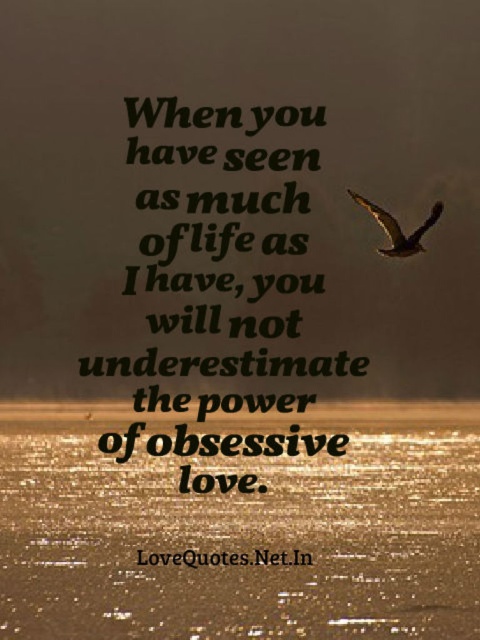
You are an artist trying to paint the scene. You need to decide which object to paint first based on their sizes. According to the description, which object should you paint first, the shiny metallic water at bottom or the black paper quote at center?

The shiny metallic water at bottom is smaller than the black paper quote at center, so you should paint the black paper quote at center first since it is larger and might require more attention to detail.

You are an artist trying to paint the scene. You need to know which object is taller between the shiny metallic water at bottom and the black text at center. Can you tell me?

The shiny metallic water at bottom is taller than the black text at center.

You are standing in a serene scene with water reflecting warm sunset hues. You notice two points marked in the image. Which point is closer to you, point (x=478, y=536) or point (x=428, y=216)?

Point (x=428, y=216) is closer to you because the description states that point (x=478, y=536) is further to the camera than point (x=428, y=216).